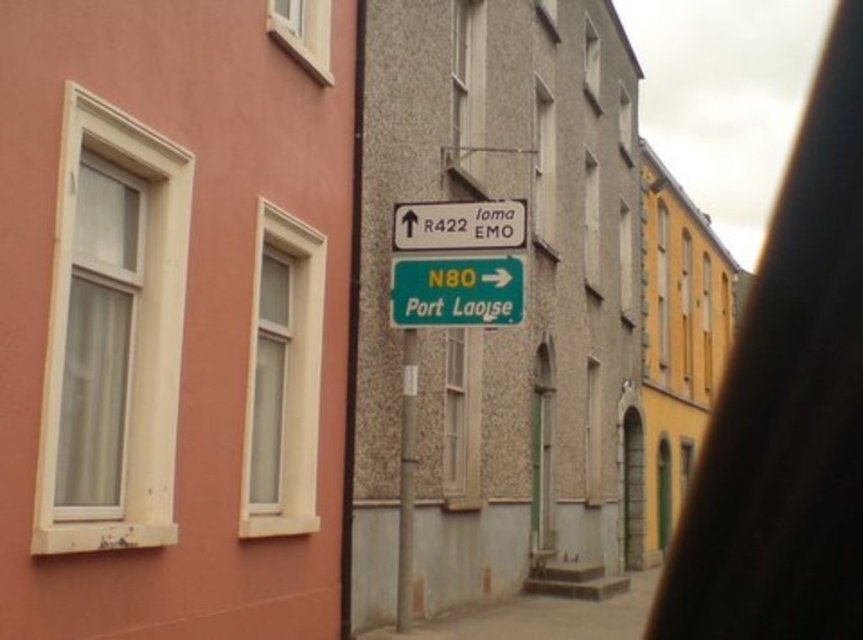
Question: Can you confirm if white plastic window at left is thinner than metallic pole at center?

Choices:
 (A) yes
 (B) no

Answer: (B)

Question: Which of these objects is positioned closest to the white plastic sign at upper center?

Choices:
 (A) clear glass window at center
 (B) clear glass window at upper left
 (C) metallic pole at center
 (D) green matte sign at center

Answer: (D)

Question: Which of these objects is positioned farthest from the green matte sign at center?

Choices:
 (A) clear glass window at center
 (B) gray concrete alley at center
 (C) metallic pole at center

Answer: (B)

Question: Is white plastic window at left to the left of metallic pole at center from the viewer's perspective?

Choices:
 (A) yes
 (B) no

Answer: (A)

Question: Can you confirm if white plastic window at left is positioned to the right of white plastic sign at upper center?

Choices:
 (A) yes
 (B) no

Answer: (B)

Question: Among these points, which one is nearest to the camera?

Choices:
 (A) (93, 204)
 (B) (539, 632)
 (C) (426, 278)
 (D) (290, 6)

Answer: (A)